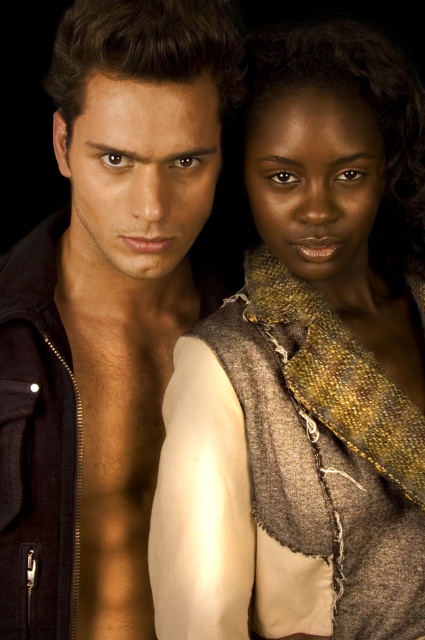
Question: Which point is farther to the camera?

Choices:
 (A) matte black jacket at left
 (B) textured brown scarf at center

Answer: (B)

Question: Can you confirm if textured brown scarf at center is positioned to the left of matte black jacket at left?

Choices:
 (A) no
 (B) yes

Answer: (A)

Question: Is textured brown scarf at center in front of matte black jacket at left?

Choices:
 (A) no
 (B) yes

Answer: (A)

Question: Is textured brown scarf at center to the right of matte black jacket at left from the viewer's perspective?

Choices:
 (A) yes
 (B) no

Answer: (A)